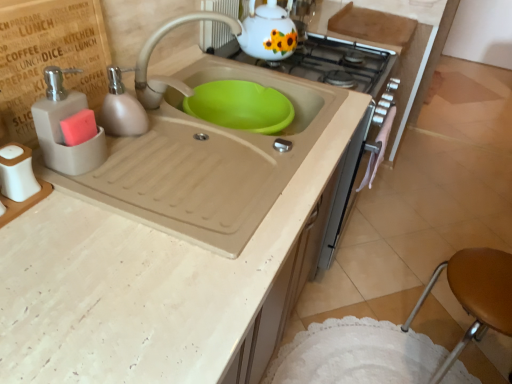
I want to click on free space above brown leather stool at lower right (from a real-world perspective), so click(x=489, y=279).